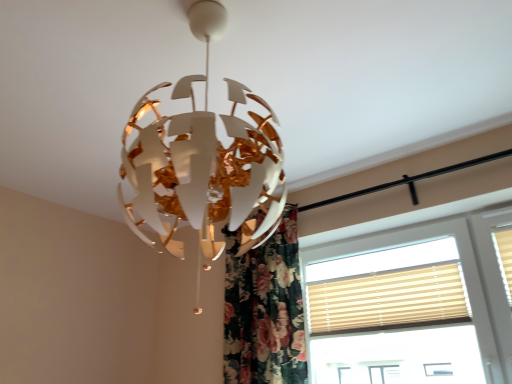
In order to face beige fabric blinds at right, should I rotate leftwards or rightwards?

You should rotate right by 15.980 degrees.

Locate an element on the screen. The image size is (512, 384). beige fabric blinds at right is located at coordinates (388, 300).

Identify the location of window in front of the floral fabric curtain at center. Image resolution: width=512 pixels, height=384 pixels. click(x=411, y=305).

From the picture: From a real-world perspective, who is located lower, beige fabric window at right or floral fabric curtain at center?

beige fabric window at right is physically lower.

Consider the image. Is beige fabric window at right looking in the opposite direction of floral fabric curtain at center?

That's not correct — beige fabric window at right is not looking away from floral fabric curtain at center.

From their relative heights in the image, would you say beige fabric window at right is taller or shorter than floral fabric curtain at center?

beige fabric window at right is shorter than floral fabric curtain at center.

Considering the positions of objects floral fabric curtain at center and beige fabric window at right in the image provided, who is more to the right, floral fabric curtain at center or beige fabric window at right?

Positioned to the right is beige fabric window at right.

Which is behind, floral fabric curtain at center or beige fabric window at right?

floral fabric curtain at center is more distant.

From the image's perspective, which one is positioned higher, floral fabric curtain at center or beige fabric window at right?

beige fabric window at right appears higher in the image.

From a real-world perspective, who is located lower, floral fabric curtain at center or beige fabric window at right?

In real-world perspective, beige fabric window at right is lower.

Is there a large distance between floral fabric curtain at center and beige fabric blinds at right?

They are positioned close to each other.

Considering the relative sizes of floral fabric curtain at center and beige fabric blinds at right in the image provided, is floral fabric curtain at center wider than beige fabric blinds at right?

Yes.

At what (x,y) coordinates should I click in order to perform the action: click on blind that is on the right side of floral fabric curtain at center. Please return your answer as a coordinate pair (x, y). Looking at the image, I should click on (388, 300).

In the scene shown: From a real-world perspective, is floral fabric curtain at center under beige fabric blinds at right?

Incorrect, from a real-world perspective, floral fabric curtain at center is higher than beige fabric blinds at right.

Which is in front, point (331, 279) or point (402, 301)?

Positioned in front is point (402, 301).

From a real-world perspective, is beige fabric window at right beneath beige fabric blinds at right?

Indeed, from a real-world perspective, beige fabric window at right is positioned beneath beige fabric blinds at right.

From the image's perspective, would you say beige fabric window at right is positioned over beige fabric blinds at right?

Yes, from the image's perspective, beige fabric window at right is over beige fabric blinds at right.

Locate an element on the screen. The image size is (512, 384). blind that is below the beige fabric window at right (from the image's perspective) is located at coordinates 388,300.

The height and width of the screenshot is (384, 512). I want to click on window that is in front of the beige fabric blinds at right, so click(x=411, y=305).

From the image's perspective, is beige fabric blinds at right located above or below beige fabric window at right?

beige fabric blinds at right is below beige fabric window at right.

Considering the sizes of beige fabric blinds at right and beige fabric window at right in the image, is beige fabric blinds at right taller or shorter than beige fabric window at right?

beige fabric blinds at right is shorter than beige fabric window at right.

Does beige fabric blinds at right lie in front of floral fabric curtain at center?

That is True.

Visually, is beige fabric blinds at right positioned to the left or to the right of floral fabric curtain at center?

In the image, beige fabric blinds at right appears on the right side of floral fabric curtain at center.

Between beige fabric blinds at right and floral fabric curtain at center, which one has smaller size?

beige fabric blinds at right is smaller.

Which object is wider, beige fabric blinds at right or floral fabric curtain at center?

Wider between the two is floral fabric curtain at center.

Where is `window that is on the right side of floral fabric curtain at center`? window that is on the right side of floral fabric curtain at center is located at coordinates (411, 305).

Image resolution: width=512 pixels, height=384 pixels. I want to click on window lying above the floral fabric curtain at center (from the image's perspective), so click(x=411, y=305).

Looking at this image, which object lies nearer to the anchor point beige fabric blinds at right, floral fabric curtain at center or beige fabric window at right?

beige fabric window at right is positioned closer to the anchor beige fabric blinds at right.

Considering their positions, is floral fabric curtain at center positioned further to beige fabric window at right than beige fabric blinds at right?

floral fabric curtain at center.

When comparing their distances from beige fabric window at right, does beige fabric blinds at right or floral fabric curtain at center seem closer?

beige fabric blinds at right lies closer to beige fabric window at right than the other object.

Considering their positions, is beige fabric window at right positioned closer to beige fabric blinds at right than floral fabric curtain at center?

beige fabric window at right is positioned closer to the anchor beige fabric blinds at right.

From the image, which object appears to be farther from floral fabric curtain at center, beige fabric blinds at right or beige fabric window at right?

The object further to floral fabric curtain at center is beige fabric window at right.

Based on their spatial positions, is beige fabric window at right or beige fabric blinds at right further from floral fabric curtain at center?

beige fabric window at right.

This screenshot has height=384, width=512. I want to click on blind situated between floral fabric curtain at center and beige fabric window at right from left to right, so click(388, 300).